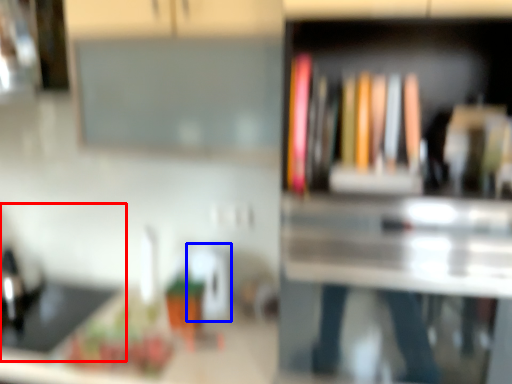
Question: Among these objects, which one is farthest to the camera, sink (highlighted by a red box) or appliance (highlighted by a blue box)?

Choices:
 (A) sink
 (B) appliance

Answer: (B)